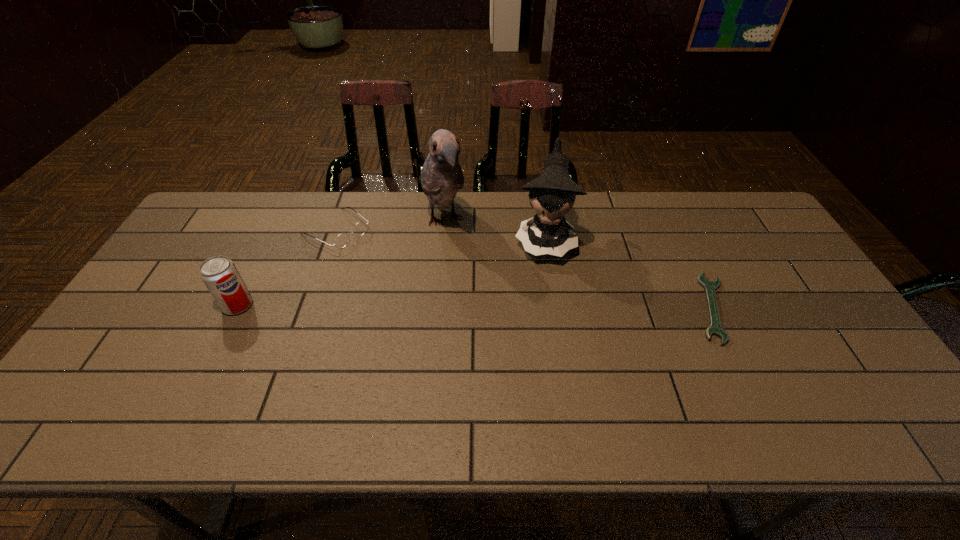
You are a GUI agent. You are given a task and a screenshot of the screen. Output one action in this format:
    pyautogui.click(x=<x>, y=<y>)
    Task: Click on the vacant space on the desktop that is between the leftmost object and the shortest object and is positioned at the face of the fourth shortest object
    The image size is (960, 540).
    Given the screenshot: What is the action you would take?
    [539, 307]

Where is `free space on the desktop that is between the third tallest object and the rightmost object and is positioned through the lenses of the fourth object from right to left`? The image size is (960, 540). free space on the desktop that is between the third tallest object and the rightmost object and is positioned through the lenses of the fourth object from right to left is located at coordinates (455, 306).

Locate an element on the screen. The height and width of the screenshot is (540, 960). vacant space on the desktop that is between the third shortest object and the shortest object and is positioned on the front-facing side of the third object from right to left is located at coordinates (480, 307).